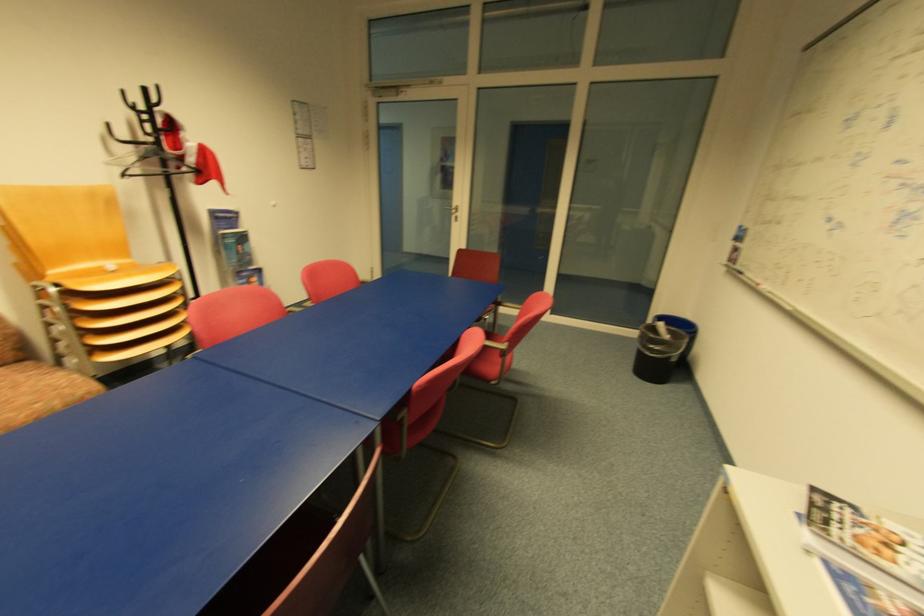
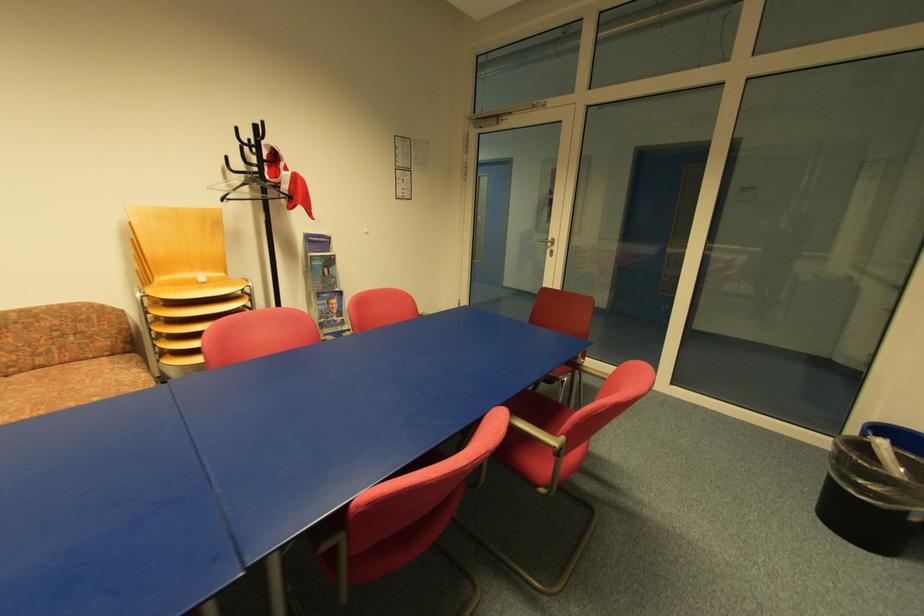
The images are taken continuously from a first-person perspective. In which direction are you moving?

The movement direction of the cameraman is right, forward.